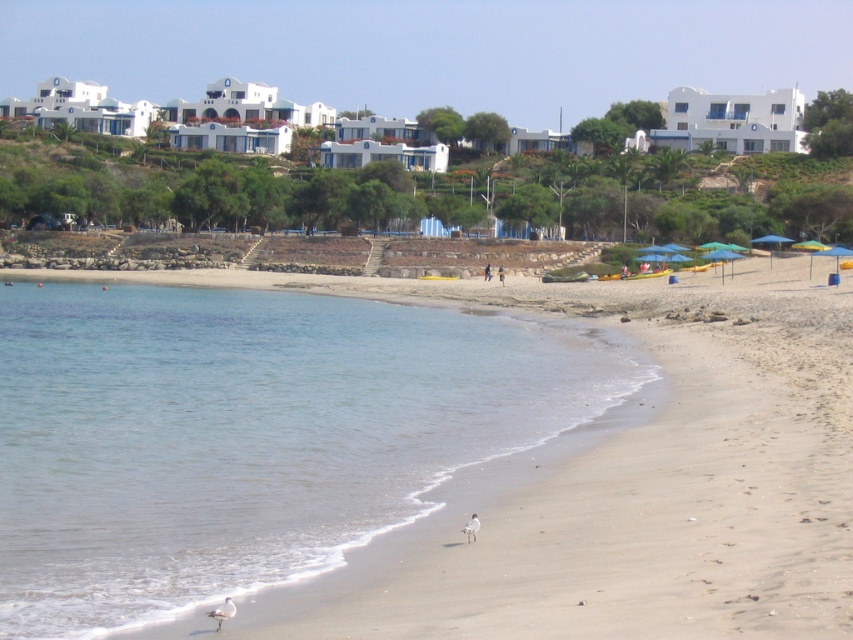
Who is more distant from viewer, (231, 602) or (489, 268)?

The point (489, 268) is behind.

Can you confirm if white feathered bird at lower left is shorter than dark blue jeans at center?

Indeed, white feathered bird at lower left has a lesser height compared to dark blue jeans at center.

Who is more distant from viewer, (230,605) or (486,266)?

Positioned behind is point (486,266).

Identify the location of white feathered bird at lower left. (222, 611).

Does white feathered bird at lower center appear over dark blue jeans at center?

No, white feathered bird at lower center is not above dark blue jeans at center.

Is point (469, 518) positioned behind point (490, 266)?

That is False.

At what (x,y) coordinates should I click in order to perform the action: click on white feathered bird at lower center. Please return your answer as a coordinate pair (x, y). Looking at the image, I should click on (471, 528).

Between clear blue water at lower left and white feathered bird at lower center, which one is positioned higher?

clear blue water at lower left

Does clear blue water at lower left appear under white feathered bird at lower center?

No, clear blue water at lower left is not below white feathered bird at lower center.

Where is `clear blue water at lower left`? The width and height of the screenshot is (853, 640). clear blue water at lower left is located at coordinates (247, 435).